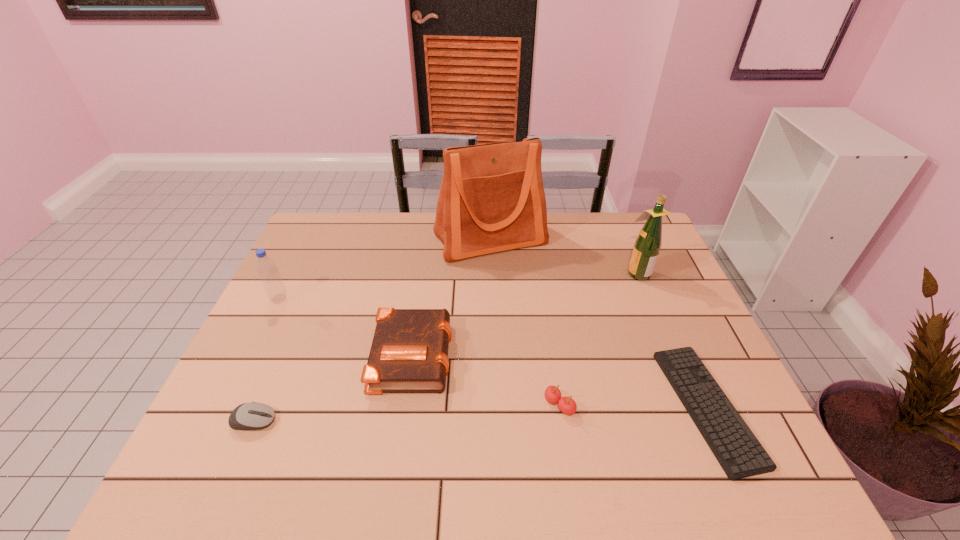
This screenshot has height=540, width=960. In order to click on vacant space in between the cherry and the tallest object in this screenshot , I will do `click(525, 322)`.

Point out which object is positioned as the fifth nearest to the tallest object. Please provide its 2D coordinates. Your answer should be formatted as a tuple, i.e. [(x, y)], where the tuple contains the x and y coordinates of a point satisfying the conditions above.

[(567, 405)]

Locate which object is the fifth closest to the Bible. Please provide its 2D coordinates. Your answer should be formatted as a tuple, i.e. [(x, y)], where the tuple contains the x and y coordinates of a point satisfying the conditions above.

[(738, 451)]

The height and width of the screenshot is (540, 960). Identify the location of vacant region that satisfies the following two spatial constraints: 1. on the front-facing side of the sixth shortest object; 2. on the front side of the bottle. (648, 299).

Find the location of `vacant area in the image that satisfies the following two spatial constraints: 1. on the spine side of the Bible; 2. on the right side of the cherry`. vacant area in the image that satisfies the following two spatial constraints: 1. on the spine side of the Bible; 2. on the right side of the cherry is located at coordinates tap(405, 405).

Identify the location of free space that satisfies the following two spatial constraints: 1. on the spine side of the shortest object; 2. on the right side of the Bible. Image resolution: width=960 pixels, height=540 pixels. (405, 407).

Locate an element on the screen. This screenshot has width=960, height=540. vacant space that satisfies the following two spatial constraints: 1. on the back side of the cherry; 2. on the spine side of the Bible is located at coordinates (551, 353).

Image resolution: width=960 pixels, height=540 pixels. What are the coordinates of `blank space that satisfies the following two spatial constraints: 1. on the front-facing side of the second tallest object; 2. on the left side of the shortest object` in the screenshot? It's located at (x=693, y=407).